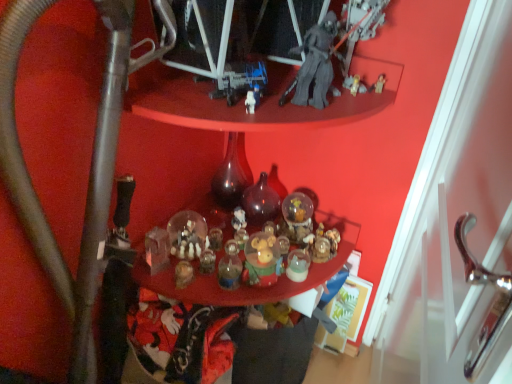
Question: Is metallic gray water pipe at lower left shorter than translucent dark glass bottle at center, positioned as the second bottle in left-to-right order?

Choices:
 (A) yes
 (B) no

Answer: (B)

Question: Does metallic gray water pipe at lower left lie behind translucent dark glass bottle at center, positioned as the second bottle in left-to-right order?

Choices:
 (A) yes
 (B) no

Answer: (B)

Question: Is metallic gray water pipe at lower left in front of translucent dark glass bottle at center, placed as the 1th bottle when sorted from right to left?

Choices:
 (A) yes
 (B) no

Answer: (A)

Question: Is metallic gray water pipe at lower left facing towards translucent dark glass bottle at center, placed as the 1th bottle when sorted from right to left?

Choices:
 (A) yes
 (B) no

Answer: (B)

Question: Considering the relative sizes of metallic gray water pipe at lower left and translucent dark glass bottle at center, positioned as the second bottle in left-to-right order, in the image provided, is metallic gray water pipe at lower left smaller than translucent dark glass bottle at center, positioned as the second bottle in left-to-right order,?

Choices:
 (A) no
 (B) yes

Answer: (A)

Question: Is point (143, 254) positioned closer to the camera than point (254, 210)?

Choices:
 (A) closer
 (B) farther

Answer: (A)

Question: From the image's perspective, is translucent glass ornaments at center located above or below translucent dark glass bottle at center, placed as the 1th bottle when sorted from right to left?

Choices:
 (A) below
 (B) above

Answer: (A)

Question: In terms of size, does translucent glass ornaments at center appear bigger or smaller than translucent dark glass bottle at center, placed as the 1th bottle when sorted from right to left?

Choices:
 (A) small
 (B) big

Answer: (B)

Question: Relative to translucent dark glass bottle at center, placed as the 1th bottle when sorted from right to left, is translucent glass ornaments at center in front or behind?

Choices:
 (A) front
 (B) behind

Answer: (A)

Question: From their relative heights in the image, would you say translucent glass bottle at center, placed as the 2th bottle when sorted from right to left, is taller or shorter than translucent dark glass bottle at center, positioned as the second bottle in left-to-right order?

Choices:
 (A) short
 (B) tall

Answer: (B)

Question: Is translucent glass bottle at center, which is the first bottle in left-to-right order, wider or thinner than translucent dark glass bottle at center, placed as the 1th bottle when sorted from right to left?

Choices:
 (A) thin
 (B) wide

Answer: (B)

Question: Is point (212, 178) positioned closer to the camera than point (270, 220)?

Choices:
 (A) farther
 (B) closer

Answer: (A)

Question: From a real-world perspective, is translucent glass bottle at center, which is the first bottle in left-to-right order, above or below translucent dark glass bottle at center, placed as the 1th bottle when sorted from right to left?

Choices:
 (A) below
 (B) above

Answer: (B)

Question: Considering the positions of point (234, 162) and point (77, 317), is point (234, 162) closer or farther from the camera than point (77, 317)?

Choices:
 (A) farther
 (B) closer

Answer: (A)

Question: From the image's perspective, is translucent glass bottle at center, which is the first bottle in left-to-right order, above or below metallic gray water pipe at lower left?

Choices:
 (A) above
 (B) below

Answer: (A)